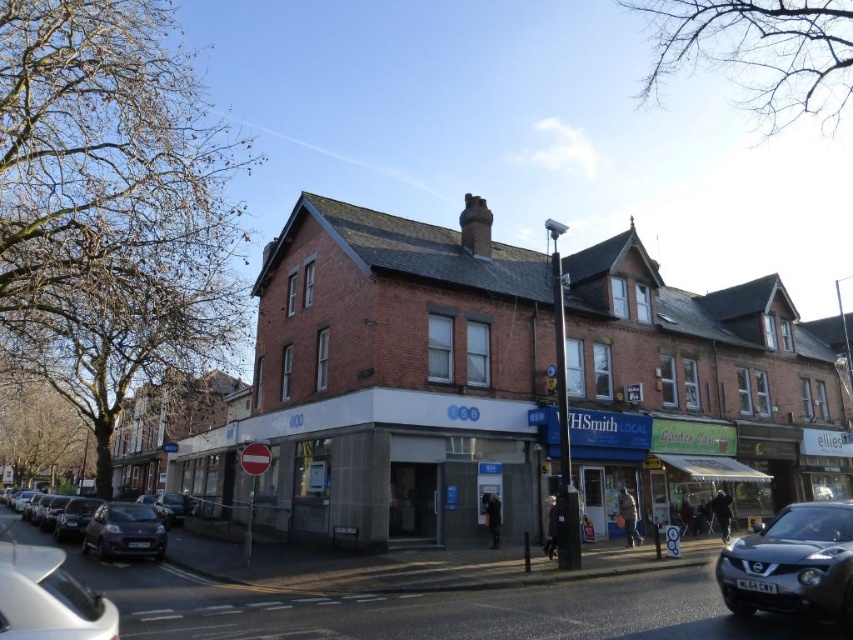
Question: Which point appears farthest from the camera in this image?

Choices:
 (A) (36, 588)
 (B) (137, 504)

Answer: (B)

Question: Among these points, which one is nearest to the camera?

Choices:
 (A) (97, 518)
 (B) (163, 518)

Answer: (A)

Question: Which object is positioned closest to the dark gray metallic car at lower left?

Choices:
 (A) shiny dark gray car at lower left
 (B) white glossy car at lower left
 (C) satin black suv at lower right

Answer: (A)

Question: Is white glossy car at lower left above shiny dark gray car at lower left?

Choices:
 (A) no
 (B) yes

Answer: (B)

Question: Does satin black suv at lower right have a larger size compared to shiny dark gray car at lower left?

Choices:
 (A) no
 (B) yes

Answer: (B)

Question: Can you confirm if white glossy car at lower left is bigger than shiny dark gray car at lower left?

Choices:
 (A) yes
 (B) no

Answer: (A)